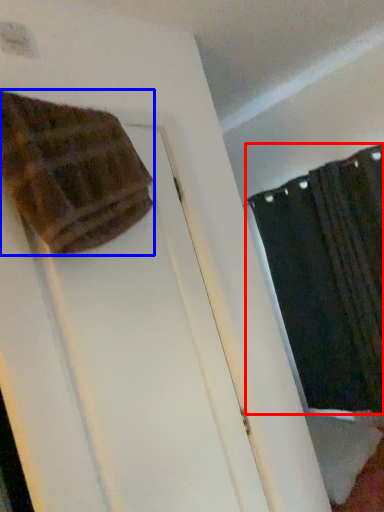
Question: Among these objects, which one is nearest to the camera, curtain (highlighted by a red box) or blanket (highlighted by a blue box)?

Choices:
 (A) curtain
 (B) blanket

Answer: (B)